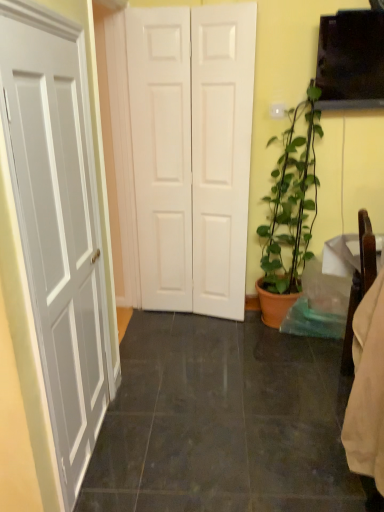
Question: In terms of size, does black glossy tile at center appear bigger or smaller than white matte door at center?

Choices:
 (A) big
 (B) small

Answer: (B)

Question: Relative to white matte door at center, is black glossy tile at center in front or behind?

Choices:
 (A) front
 (B) behind

Answer: (A)

Question: Estimate the real-world distances between objects in this image. Which object is farther from the black glossy tile at center?

Choices:
 (A) matte terracotta pot at right
 (B) white matte door at center

Answer: (B)

Question: Which object is the farthest from the matte terracotta pot at right?

Choices:
 (A) black glossy tile at center
 (B) white matte door at center

Answer: (A)